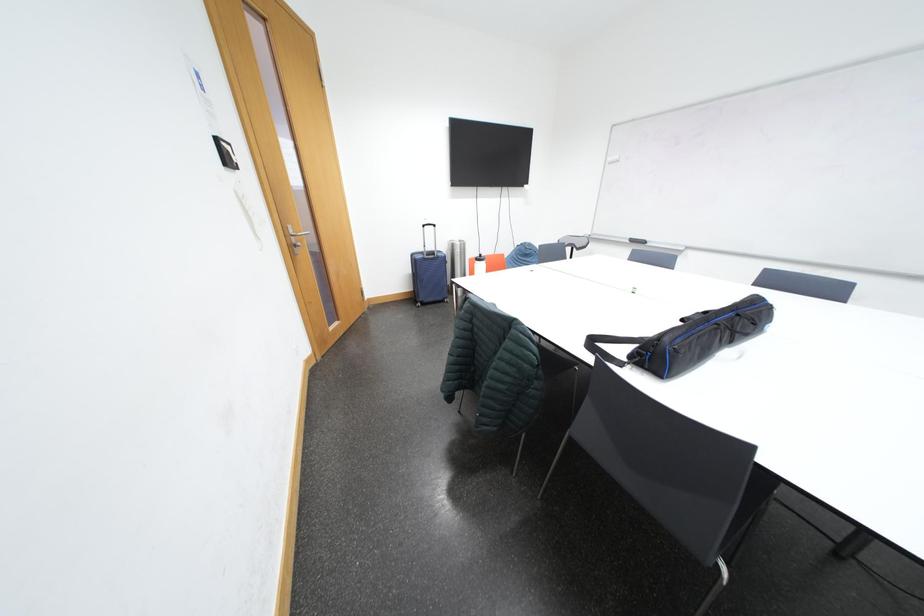
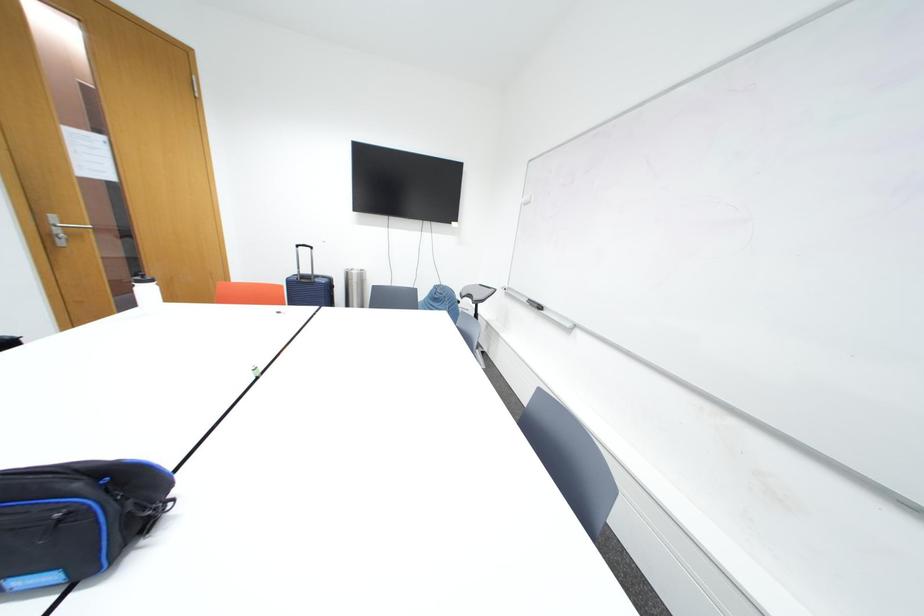
In a continuous first-person perspective shot, in which direction is the camera moving?

The cameraman walked toward right, forward.